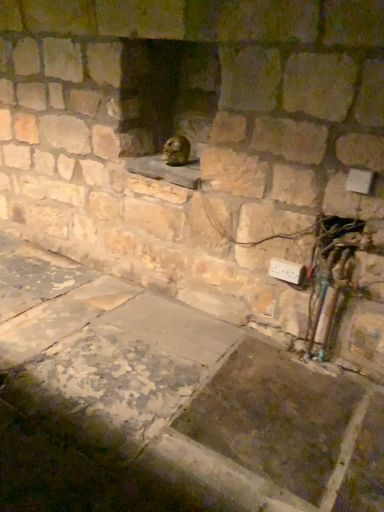
Question: Is shiny brown rodent at center inside or outside of white plastic electric outlet at lower right?

Choices:
 (A) outside
 (B) inside

Answer: (A)

Question: Is shiny brown rodent at center wider or thinner than white plastic electric outlet at lower right?

Choices:
 (A) thin
 (B) wide

Answer: (B)

Question: From a real-world perspective, is shiny brown rodent at center above or below white plastic electric outlet at lower right?

Choices:
 (A) below
 (B) above

Answer: (B)

Question: From the image's perspective, relative to shiny brown rodent at center, is white plastic electric outlet at lower right above or below?

Choices:
 (A) below
 (B) above

Answer: (A)

Question: From a real-world perspective, is white plastic electric outlet at lower right above or below shiny brown rodent at center?

Choices:
 (A) above
 (B) below

Answer: (B)

Question: Would you say white plastic electric outlet at lower right is to the left or to the right of shiny brown rodent at center in the picture?

Choices:
 (A) right
 (B) left

Answer: (A)

Question: Is point (281, 268) positioned closer to the camera than point (178, 159)?

Choices:
 (A) closer
 (B) farther

Answer: (A)